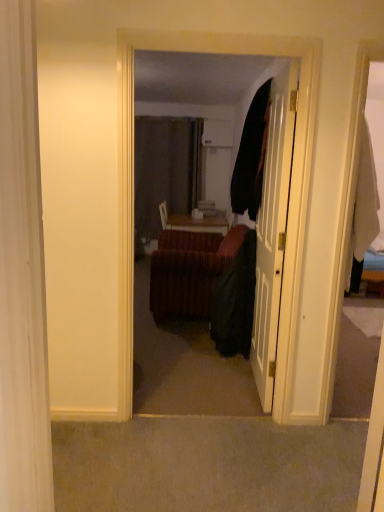
Locate an element on the screen. free point in front of velvet couch at center is located at coordinates (194, 460).